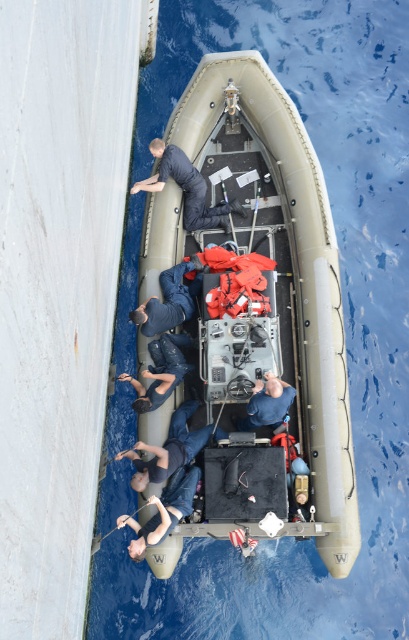
Consider the image. You are a crew member on the ship and need to locate the dark blue fabric at lower left and the tan rubber boat at center. From your vantage point on the ship, which object is closer to the left side of the scene?

The dark blue fabric at lower left is closer to the left side of the scene because the tan rubber boat at center is to the right of it.

You are on a rescue boat and need to retrieve an item that fell into the water. The item is near the dark blue fabric at lower left. To reach it, you must move past the dark blue uniform at center. Which direction should you move first?

You should move towards the dark blue fabric at lower left first because it is closer to you than the dark blue uniform at center, which is further away.

You are standing on the deck of a ship and see the tan rubber boat at center. If you want to throw a rope to someone on the boat, and your maximum throwing distance is 7 meters, will you be able to reach them?

The tan rubber boat at center is 7.46 meters away from the camera, which is beyond your maximum throwing distance of 7 meters. Therefore, you will not be able to reach them with a rope throw.